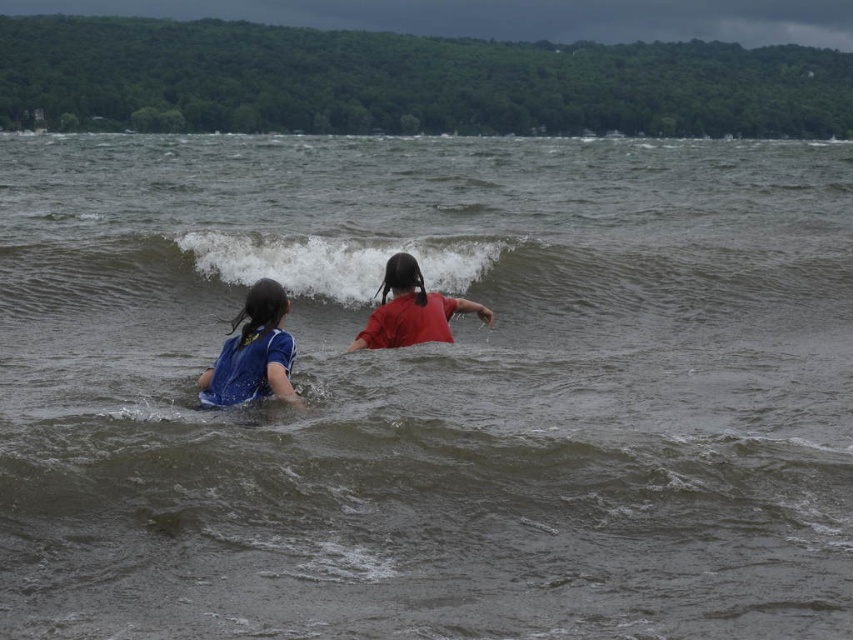
Between point (332, 275) and point (398, 259), which one is positioned in front?

Point (398, 259) is in front.

Where is `white frothy wave at center`? This screenshot has height=640, width=853. white frothy wave at center is located at coordinates (346, 260).

Is white frothy wave at center smaller than blue fabric shirt at center?

Indeed, white frothy wave at center has a smaller size compared to blue fabric shirt at center.

Between point (329, 276) and point (242, 333), which one is positioned in front?

Point (242, 333) is in front.

Is point (258, 272) more distant than point (227, 385)?

Yes, point (258, 272) is behind point (227, 385).

Where is `white frothy wave at center`? The width and height of the screenshot is (853, 640). white frothy wave at center is located at coordinates (346, 260).

Can you confirm if blue fabric shirt at center is thinner than red matte shirt at center?

Yes, blue fabric shirt at center is thinner than red matte shirt at center.

Which is more to the right, blue fabric shirt at center or red matte shirt at center?

Positioned to the right is red matte shirt at center.

Locate an element on the screen. blue fabric shirt at center is located at coordinates pyautogui.click(x=253, y=353).

Where is `blue fabric shirt at center`? blue fabric shirt at center is located at coordinates (253, 353).